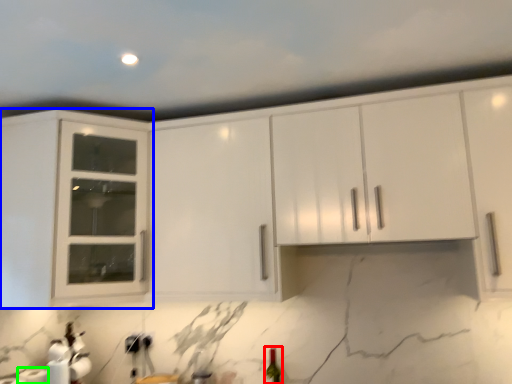
Question: Considering the real-world distances, which object is farthest from wine bottle (highlighted by a red box)? cabinetry (highlighted by a blue box) or paper towel (highlighted by a green box)?

Choices:
 (A) cabinetry
 (B) paper towel

Answer: (A)